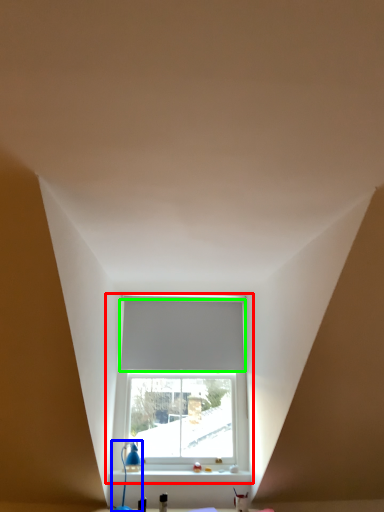
Question: Which object is positioned farthest from window (highlighted by a red box)? Select from table lamp (highlighted by a blue box) and blind (highlighted by a green box).

Choices:
 (A) table lamp
 (B) blind

Answer: (A)